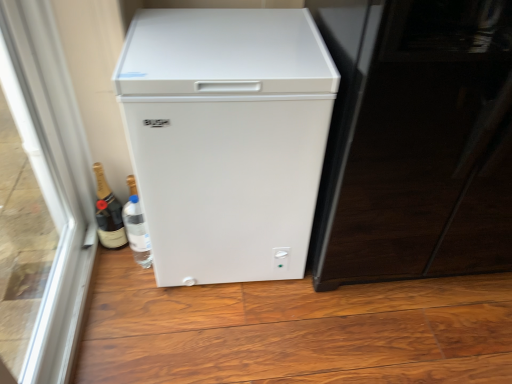
Question: Would you say glossy black screen door at right is to the left or to the right of white matte refrigerator at center in the picture?

Choices:
 (A) left
 (B) right

Answer: (B)

Question: From the image's perspective, is glossy black screen door at right above or below white matte refrigerator at center?

Choices:
 (A) above
 (B) below

Answer: (A)

Question: Considering the real-world distances, which object is closest to the matte gold champagne bottle at lower left?

Choices:
 (A) glossy black screen door at right
 (B) white matte refrigerator at center
 (C) transparent glass door at left

Answer: (C)

Question: Estimate the real-world distances between objects in this image. Which object is closer to the glossy black screen door at right?

Choices:
 (A) transparent glass door at left
 (B) matte gold champagne bottle at lower left
 (C) white matte refrigerator at center

Answer: (C)